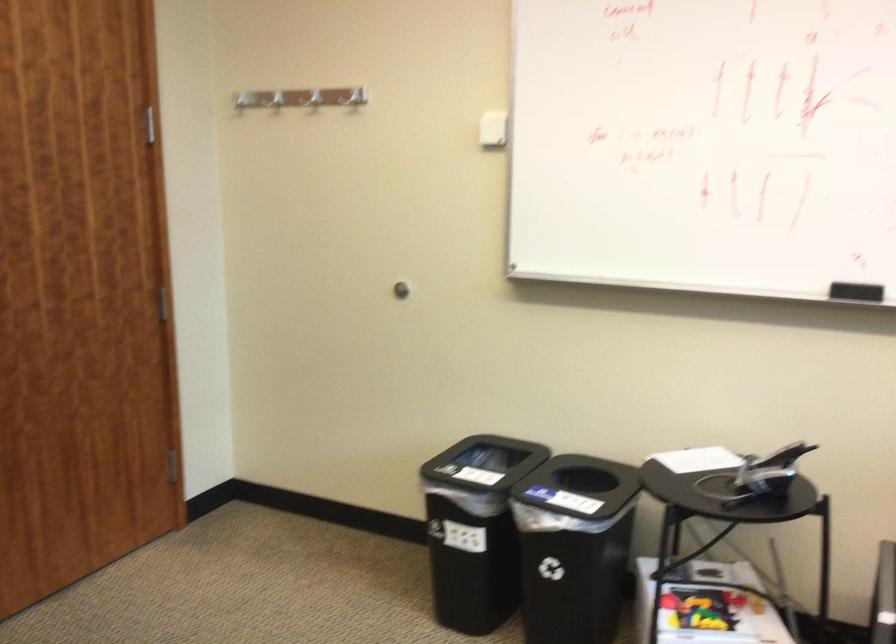
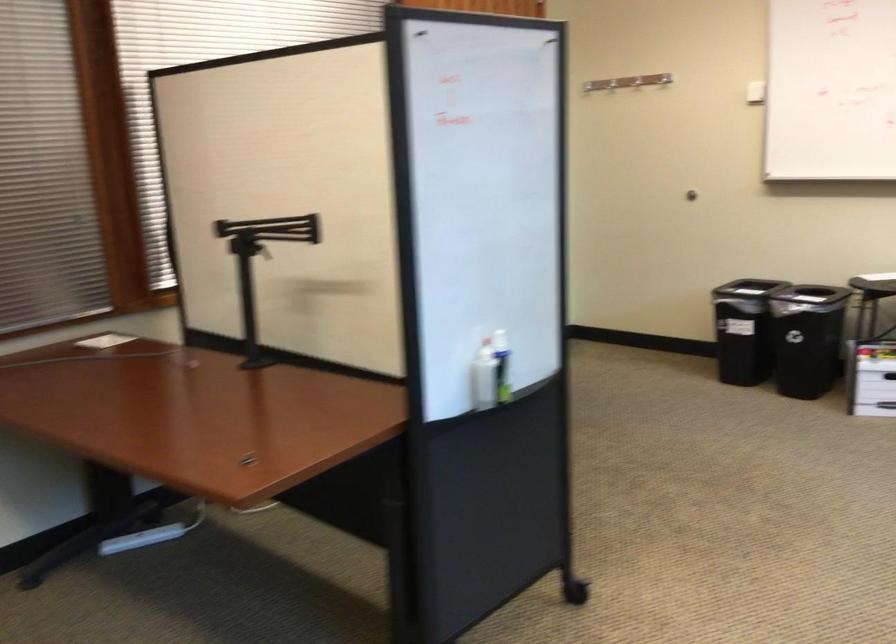
Question: I am providing you with two images of the same scene from different viewpoints. After the viewpoint changes to image2, which objects are now occluded?

Choices:
 (A) silver coat hook
 (B) black monitor arm
 (C) metal coat hook
 (D) wireframe decoration

Answer: (A)